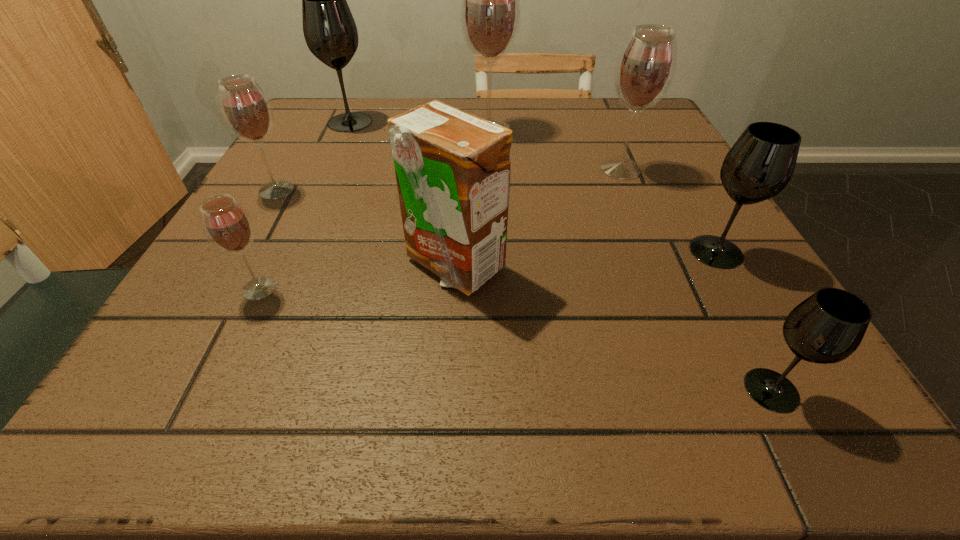
Where is `the smallest red wineglass`? The height and width of the screenshot is (540, 960). the smallest red wineglass is located at coordinates (227, 225).

Locate an element on the screen. The height and width of the screenshot is (540, 960). the smallest gray wineglass is located at coordinates click(x=827, y=327).

Identify the location of the nearest gray wineglass. The width and height of the screenshot is (960, 540). (827, 327).

Where is `vacant region located 0.070m on the right of the tallest object`? The image size is (960, 540). vacant region located 0.070m on the right of the tallest object is located at coordinates [545, 130].

Find the location of a particular element. blank space located 0.320m on the front of the farthest gray wineglass is located at coordinates (305, 221).

This screenshot has width=960, height=540. I want to click on blank space located 0.230m on the left of the third smallest red wineglass, so click(481, 170).

Locate an element on the screen. Image resolution: width=960 pixels, height=540 pixels. blank space located 0.170m on the straw side of the carton is located at coordinates (445, 409).

The image size is (960, 540). In order to click on free space located 0.320m on the front of the second smallest red wineglass in this screenshot , I will do `click(187, 346)`.

Locate an element on the screen. The width and height of the screenshot is (960, 540). vacant region located 0.230m on the left of the second biggest gray wineglass is located at coordinates (546, 252).

I want to click on free space located on the right of the smallest red wineglass, so click(544, 288).